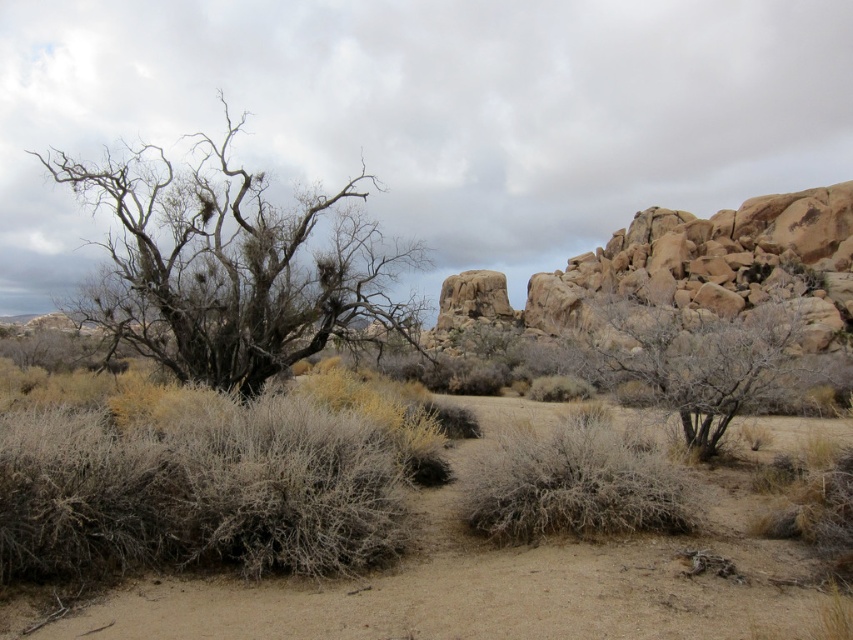
Question: Which of these objects is positioned farthest from the grayish-brown textured bush at lower left?

Choices:
 (A) fuzzy gray bush at center
 (B) dead wood tree at left

Answer: (B)

Question: Observing the image, what is the correct spatial positioning of brown sandy soil at center in reference to grayish-brown textured bush at lower left?

Choices:
 (A) above
 (B) below

Answer: (B)

Question: Does grayish-brown textured bush at lower left appear on the left side of dry shrub at center?

Choices:
 (A) no
 (B) yes

Answer: (B)

Question: Considering the relative positions of fuzzy gray bush at center and dry shrub at center in the image provided, where is fuzzy gray bush at center located with respect to dry shrub at center?

Choices:
 (A) below
 (B) above

Answer: (A)

Question: Among these points, which one is nearest to the camera?

Choices:
 (A) (317, 205)
 (B) (628, 474)
 (C) (622, 324)

Answer: (B)

Question: Which is nearer to the brown sandy soil at center?

Choices:
 (A) dead wood tree at left
 (B) dry shrub at center

Answer: (B)